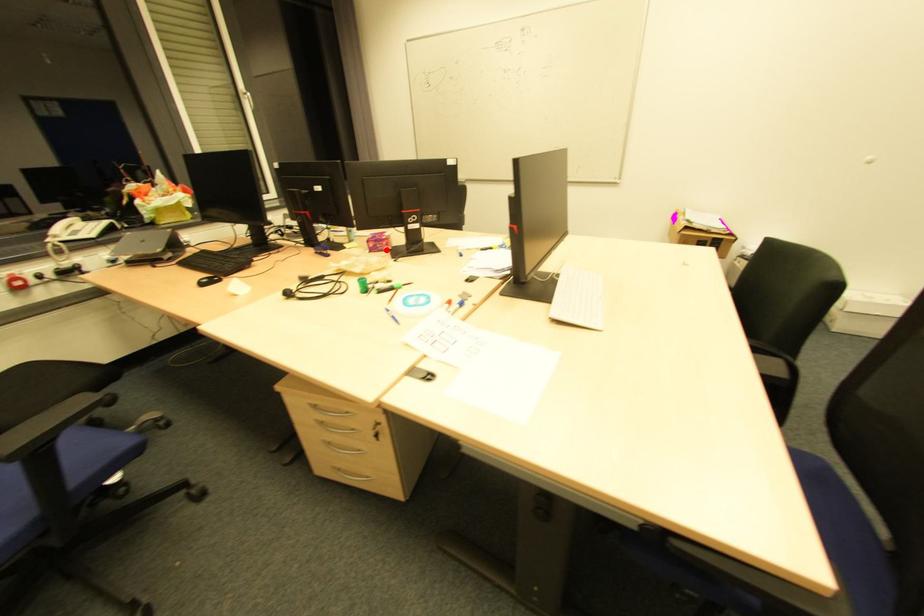
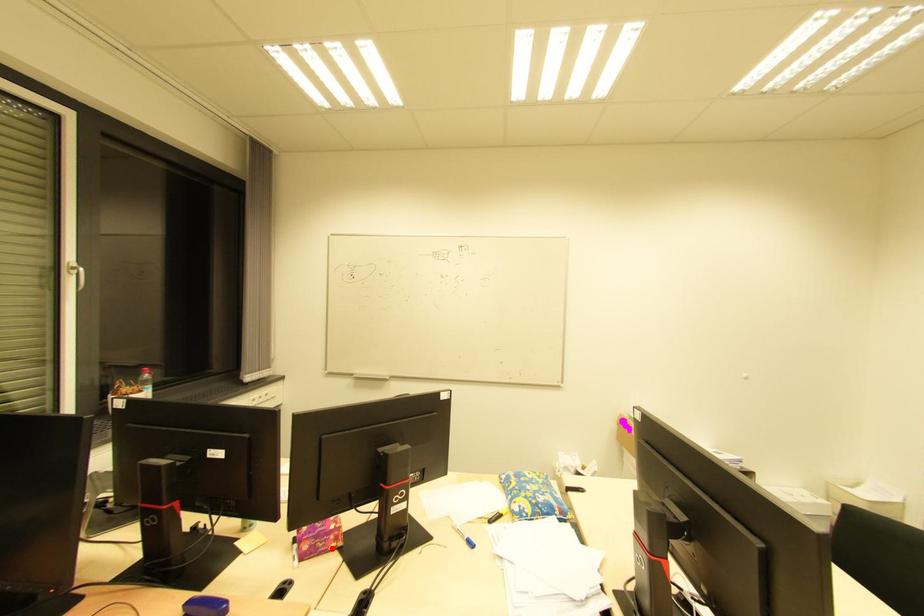
I am providing you with two images of the same scene from different viewpoints. A red point is marked on the first image and another point is marked on the second image. Are the points marked in image1 and image2 representing the same 3D position?

Yes